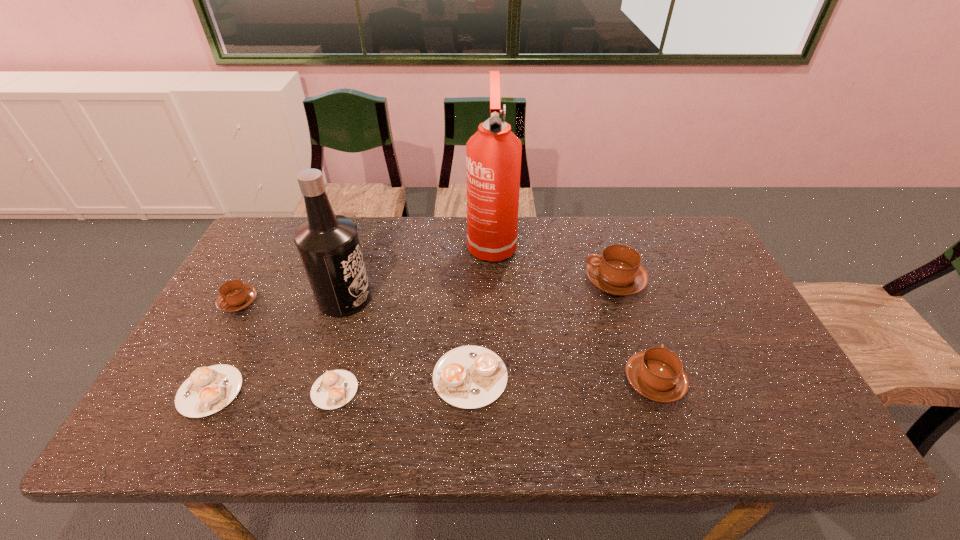
Find the location of a particular element. This screenshot has height=540, width=960. free space located 0.280m on the side of the tallest cappuccino with the handle is located at coordinates (492, 280).

This screenshot has height=540, width=960. I want to click on vacant space situated 0.180m on the side of the second tallest cappuccino with the handle, so click(x=629, y=305).

This screenshot has width=960, height=540. I want to click on vacant space located 0.060m on the side of the second tallest cappuccino with the handle, so click(x=640, y=338).

Identify the location of free region located 0.400m on the side of the second tallest cappuccino with the handle. The height and width of the screenshot is (540, 960). (612, 254).

Identify the location of vacant region located on the side of the smallest brown cappuccino with the handle. (174, 420).

Find the location of a particular element. vacant space located 0.210m on the back of the third cappuccino from right to left is located at coordinates (472, 289).

This screenshot has height=540, width=960. Find the location of `free space located on the right of the leftmost white cappuccino`. free space located on the right of the leftmost white cappuccino is located at coordinates (364, 391).

What are the coordinates of `free spot located 0.170m on the right of the smallest white cappuccino` in the screenshot? It's located at (429, 390).

Find the location of a particular element. fire extinguisher located at the far edge is located at coordinates (493, 154).

You are a GUI agent. You are given a task and a screenshot of the screen. Output one action in this format:
    pyautogui.click(x=<x>, y=<y>)
    Task: Click on the cappuccino that is at the far edge
    The image size is (960, 540).
    Given the screenshot: What is the action you would take?
    pyautogui.click(x=617, y=271)